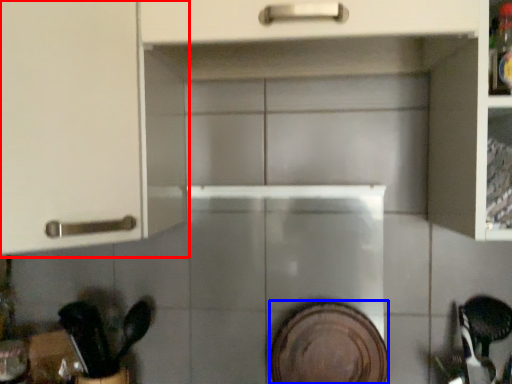
Question: Which point is closer to the camera, cabinetry (highlighted by a red box) or platter (highlighted by a blue box)?

Choices:
 (A) cabinetry
 (B) platter

Answer: (A)